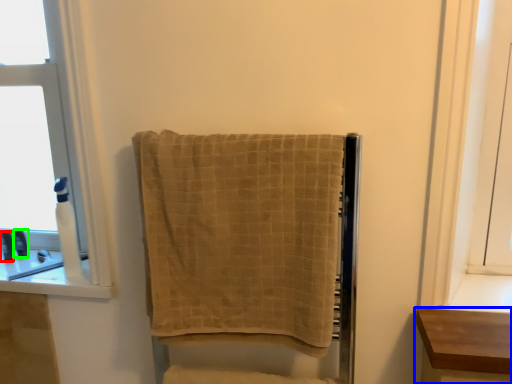
Question: Which is nearer to the toiletry (highlighted by a red box)? furniture (highlighted by a blue box) or toiletry (highlighted by a green box).

Choices:
 (A) furniture
 (B) toiletry

Answer: (B)